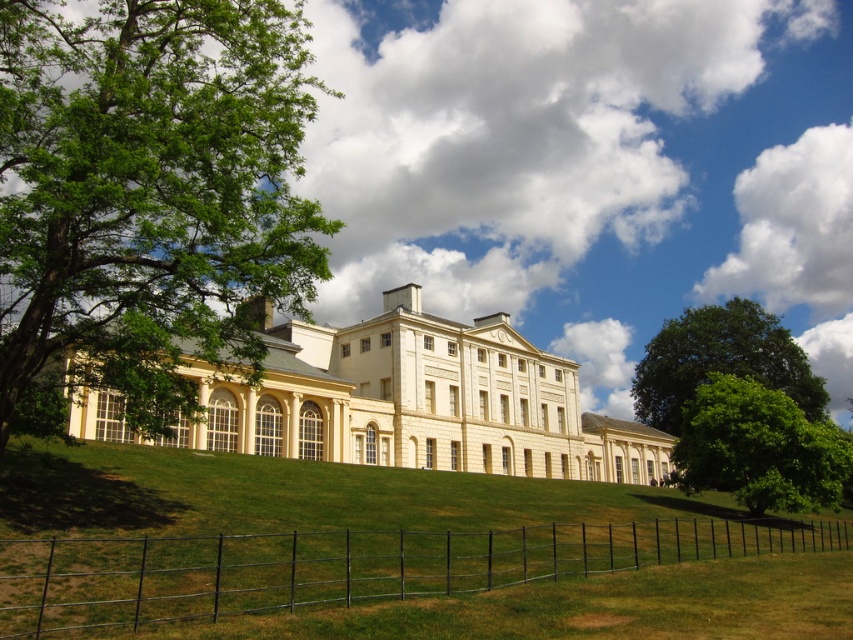
Looking at this image, is black wire fence at lower center behind green leafy tree at upper right?

No, black wire fence at lower center is closer to the viewer.

Does black wire fence at lower center appear under green leafy tree at upper right?

Correct, black wire fence at lower center is located below green leafy tree at upper right.

Is point (54, 564) less distant than point (694, 320)?

Yes.

You are a GUI agent. You are given a task and a screenshot of the screen. Output one action in this format:
    pyautogui.click(x=<x>, y=<y>)
    Task: Click on the black wire fence at lower center
    The image size is (853, 640).
    Given the screenshot: What is the action you would take?
    pyautogui.click(x=346, y=566)

In the scene shown: Does green leafy tree at left have a lesser width compared to matte cream building at center?

Yes, green leafy tree at left is thinner than matte cream building at center.

Between point (207, 129) and point (384, 332), which one is positioned behind?

The point (384, 332) is more distant.

Where is `green leafy tree at left`? Image resolution: width=853 pixels, height=640 pixels. green leafy tree at left is located at coordinates (148, 198).

Which is more to the left, matte cream building at center or green leafy tree at lower right?

From the viewer's perspective, matte cream building at center appears more on the left side.

Is matte cream building at center below green leafy tree at lower right?

No.

Who is more forward, (521,394) or (701,448)?

Point (701,448)

Locate an element on the screen. This screenshot has height=640, width=853. matte cream building at center is located at coordinates (418, 401).